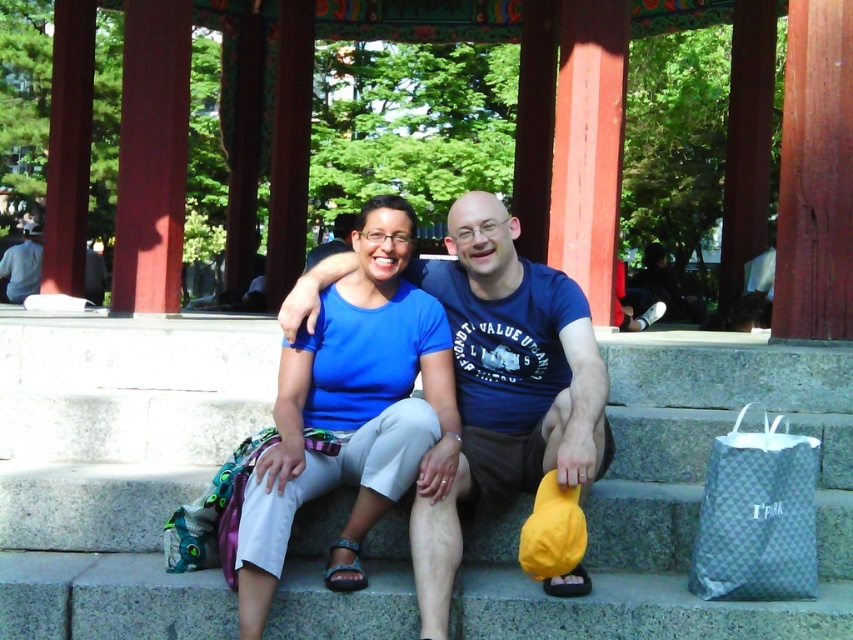
Question: Which point is closer to the camera?

Choices:
 (A) (585, 352)
 (B) (27, 276)
 (C) (352, 348)

Answer: (A)

Question: Estimate the real-world distances between objects in this image. Which object is farther from the denim pants at lower left?

Choices:
 (A) blue cotton t-shirt at center
 (B) gray woven fabric bag at lower right

Answer: (A)

Question: In this image, where is blue fabric shirt at center located relative to denim pants at lower left?

Choices:
 (A) above
 (B) below

Answer: (B)

Question: Can you confirm if blue cotton t-shirt at center is bigger than blue fabric shirt at center?

Choices:
 (A) no
 (B) yes

Answer: (A)

Question: Which point appears closest to the camera in this image?

Choices:
 (A) (16, 291)
 (B) (815, 545)

Answer: (B)

Question: Considering the relative positions of gray woven fabric bag at lower right and denim pants at lower left in the image provided, where is gray woven fabric bag at lower right located with respect to denim pants at lower left?

Choices:
 (A) below
 (B) above

Answer: (A)